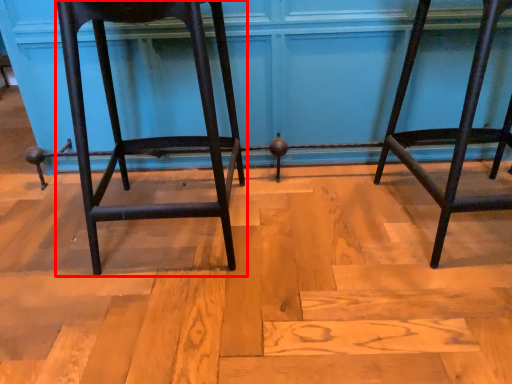
Question: Where is furniture (annotated by the red box) located in relation to furniture in the image?

Choices:
 (A) left
 (B) right

Answer: (A)